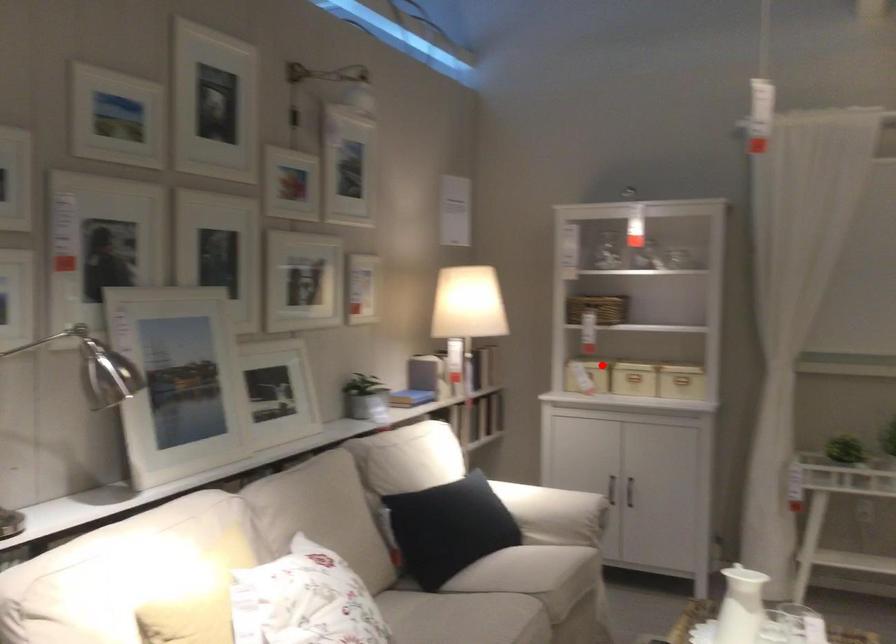
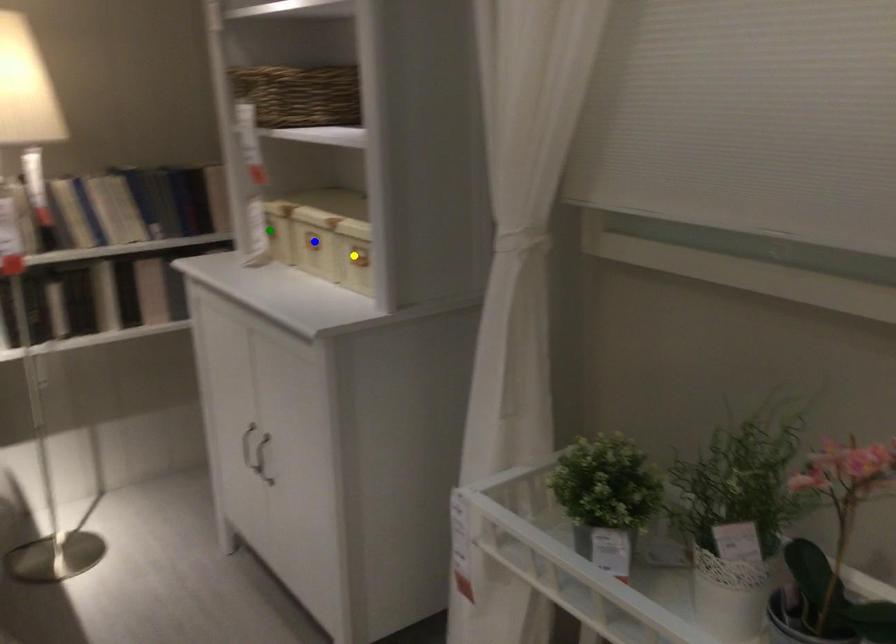
Question: I am providing you with two images of the same scene from different viewpoints. A red point is marked on the first image. You are given multiple points on the second image. Can you choose the point in image 2 that corresponds to the point in image 1?

Choices:
 (A) yellow point
 (B) green point
 (C) blue point

Answer: (B)